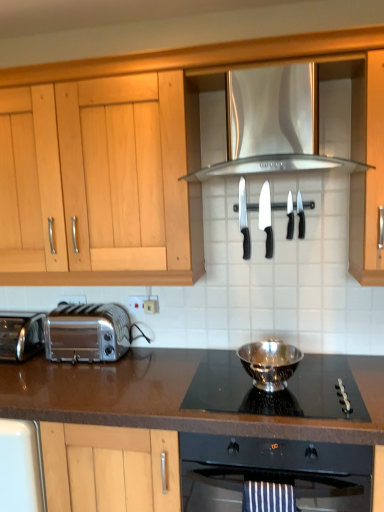
This screenshot has height=512, width=384. Find the location of `vacant area to the right of polished stainless steel bowl at center`. vacant area to the right of polished stainless steel bowl at center is located at coordinates (350, 382).